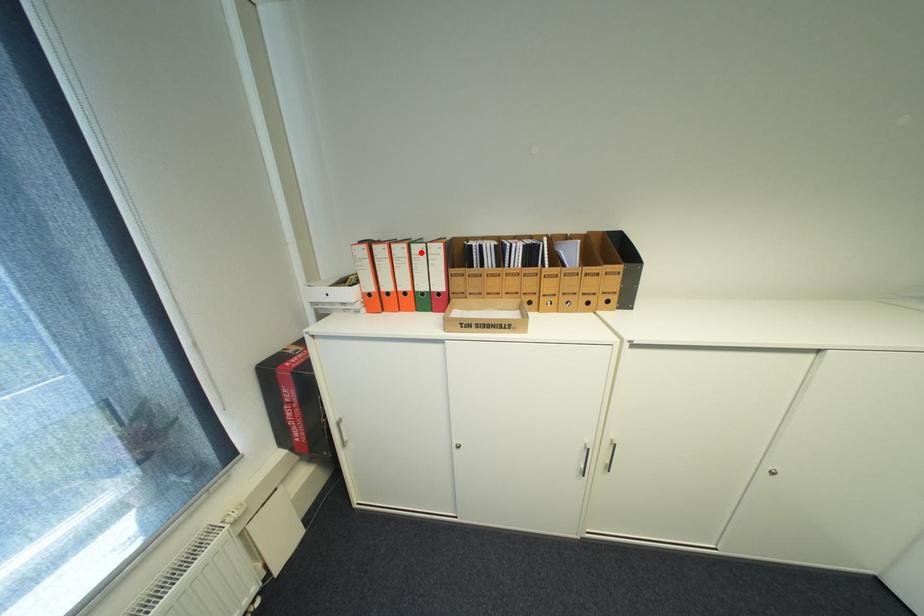
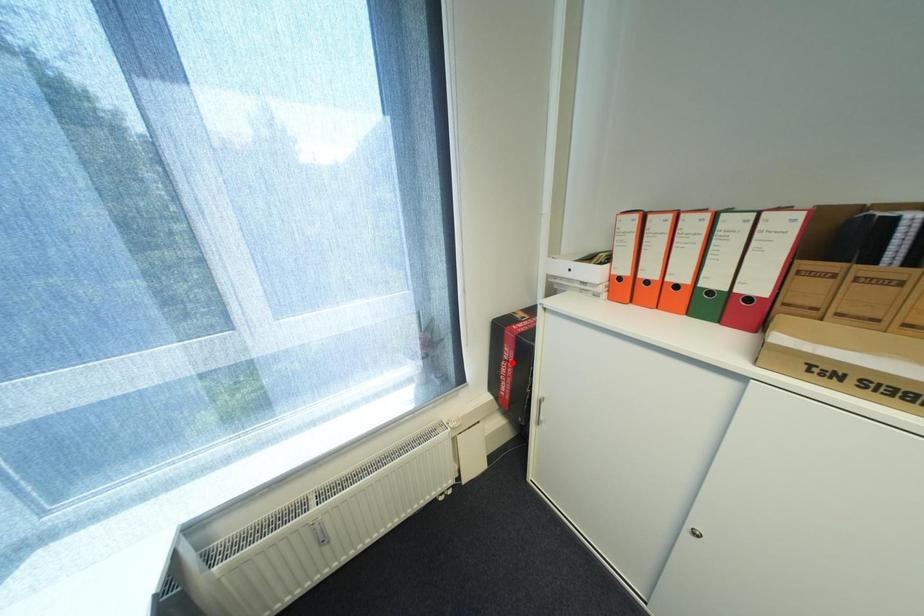
I am providing you with two images of the same scene from different viewpoints. A red point is marked on the first image and another point is marked on the second image. Do the highlighted points in image1 and image2 indicate the same real-world spot?

No